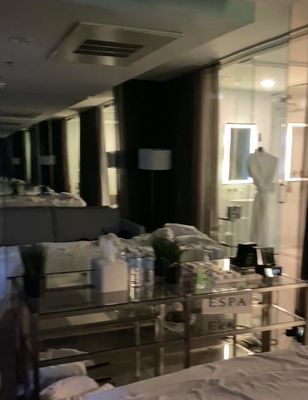
I want to click on mannequin, so click(266, 169).